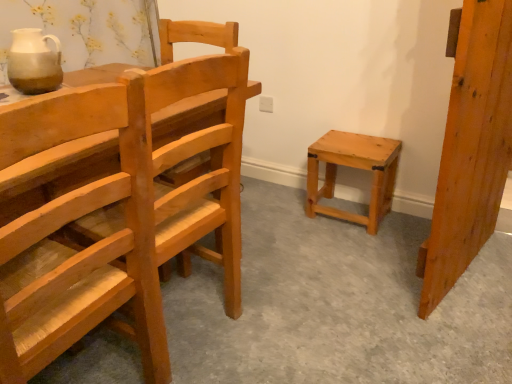
Question: Considering the relative sizes of matte ceramic jug at upper left and natural wood door at right in the image provided, is matte ceramic jug at upper left bigger than natural wood door at right?

Choices:
 (A) yes
 (B) no

Answer: (B)

Question: Considering the relative positions of matte ceramic jug at upper left and natural wood door at right in the image provided, is matte ceramic jug at upper left to the right of natural wood door at right from the viewer's perspective?

Choices:
 (A) no
 (B) yes

Answer: (A)

Question: Is matte ceramic jug at upper left shorter than natural wood door at right?

Choices:
 (A) no
 (B) yes

Answer: (B)

Question: Does matte ceramic jug at upper left have a lesser width compared to natural wood door at right?

Choices:
 (A) no
 (B) yes

Answer: (B)

Question: Considering the relative positions of matte ceramic jug at upper left and natural wood door at right in the image provided, is matte ceramic jug at upper left to the left of natural wood door at right from the viewer's perspective?

Choices:
 (A) no
 (B) yes

Answer: (B)

Question: In the image, is matte ceramic jug at upper left on the left side or the right side of natural wood stool at center-right?

Choices:
 (A) right
 (B) left

Answer: (B)

Question: Is point (26, 52) positioned closer to the camera than point (332, 208)?

Choices:
 (A) closer
 (B) farther

Answer: (A)

Question: From a real-world perspective, relative to natural wood stool at center-right, is matte ceramic jug at upper left vertically above or below?

Choices:
 (A) above
 (B) below

Answer: (A)

Question: Considering the positions of matte ceramic jug at upper left and natural wood stool at center-right in the image, is matte ceramic jug at upper left taller or shorter than natural wood stool at center-right?

Choices:
 (A) tall
 (B) short

Answer: (B)

Question: From their relative heights in the image, would you say natural wood stool at center-right is taller or shorter than natural wood door at right?

Choices:
 (A) tall
 (B) short

Answer: (B)

Question: Would you say natural wood stool at center-right is inside or outside natural wood door at right?

Choices:
 (A) inside
 (B) outside

Answer: (B)

Question: From the image's perspective, is natural wood stool at center-right above or below natural wood door at right?

Choices:
 (A) above
 (B) below

Answer: (B)

Question: Is point (392, 142) closer or farther from the camera than point (467, 122)?

Choices:
 (A) farther
 (B) closer

Answer: (A)

Question: Considering the relative positions of matte ceramic jug at upper left and natural wood door at right in the image provided, is matte ceramic jug at upper left to the left or to the right of natural wood door at right?

Choices:
 (A) left
 (B) right

Answer: (A)

Question: Is matte ceramic jug at upper left taller or shorter than natural wood door at right?

Choices:
 (A) short
 (B) tall

Answer: (A)